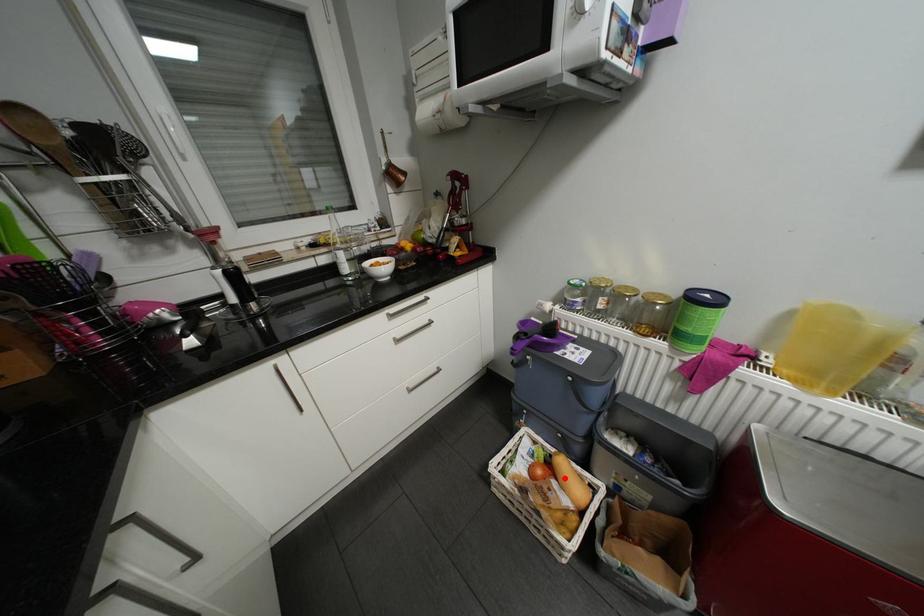
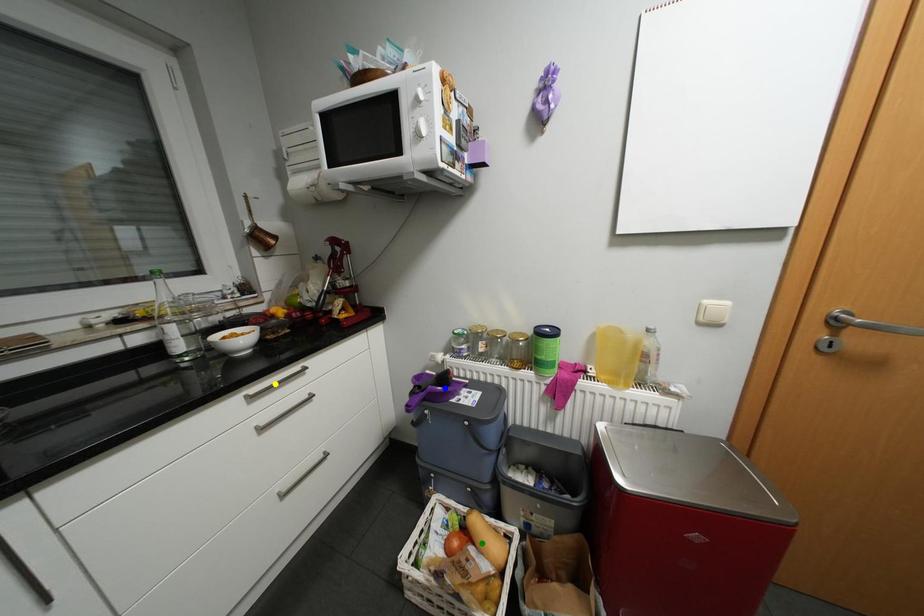
Question: I am providing you with two images of the same scene from different viewpoints. A red point is marked on the first image. You are given multiple points on the second image. Which spot in image 2 lines up with the point in image 1?

Choices:
 (A) yellow point
 (B) green point
 (C) blue point

Answer: (B)